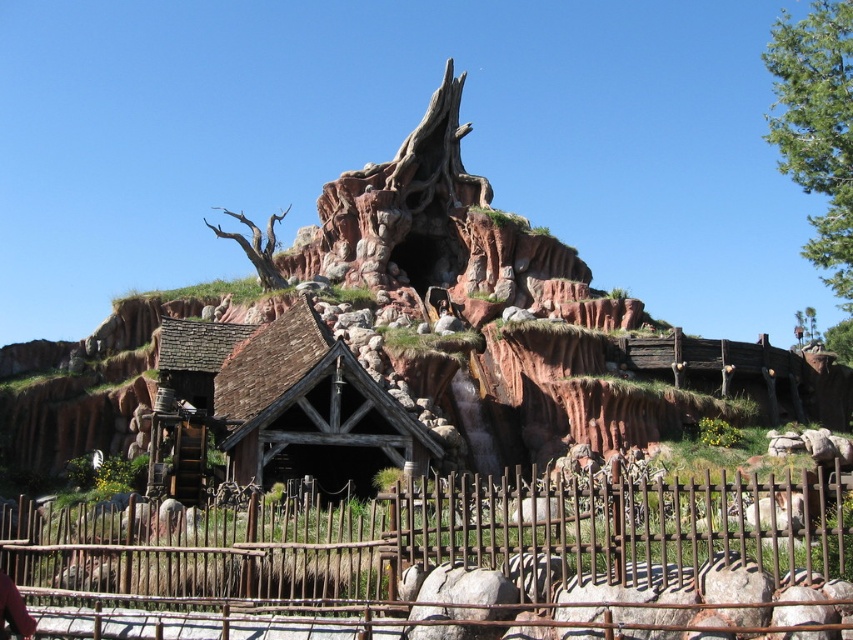
Question: Estimate the real-world distances between objects in this image. Which object is closer to the brown wooden hut at center?

Choices:
 (A) green leafy tree at upper right
 (B) brown textured bark tree at upper center

Answer: (B)

Question: Is green leafy tree at upper right behind brown textured bark tree at upper center?

Choices:
 (A) no
 (B) yes

Answer: (A)

Question: Can you confirm if green leafy tree at upper right is bigger than brown textured bark tree at upper center?

Choices:
 (A) yes
 (B) no

Answer: (A)

Question: Among these objects, which one is farthest from the camera?

Choices:
 (A) brown wooden hut at center
 (B) brown textured bark tree at upper center
 (C) green leafy tree at upper right

Answer: (B)

Question: Does brown wooden hut at center have a larger size compared to brown textured bark tree at upper center?

Choices:
 (A) yes
 (B) no

Answer: (B)

Question: Which object appears farthest from the camera in this image?

Choices:
 (A) brown textured bark tree at upper center
 (B) rustic wood fence at lower center
 (C) brown wooden hut at center

Answer: (A)